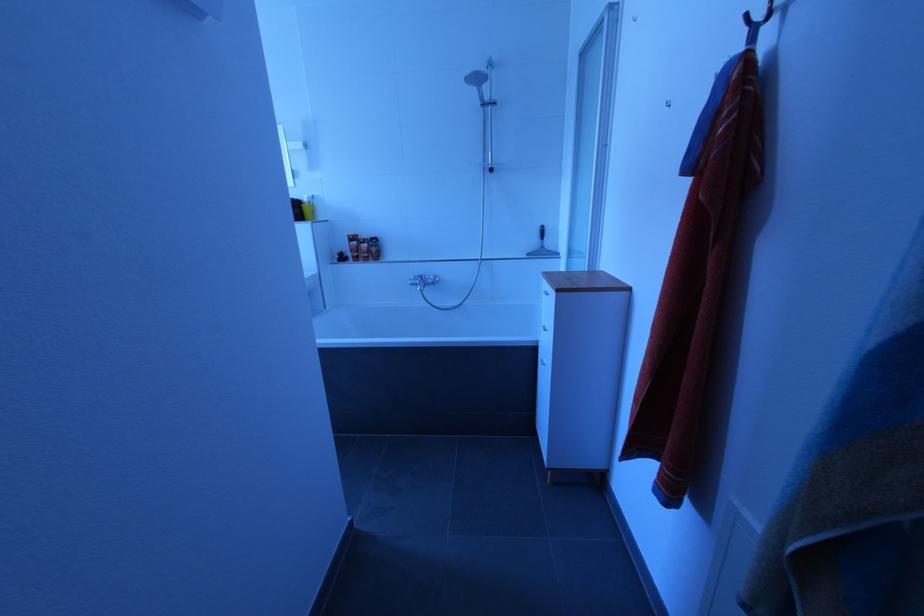
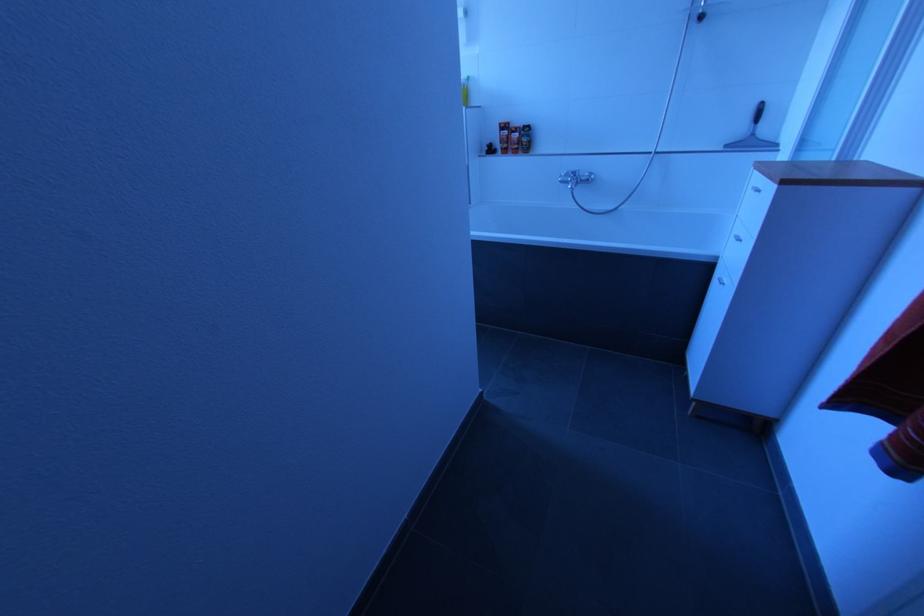
The images are taken continuously from a first-person perspective. In which direction is your viewpoint rotating?

The camera rotated toward left-down.